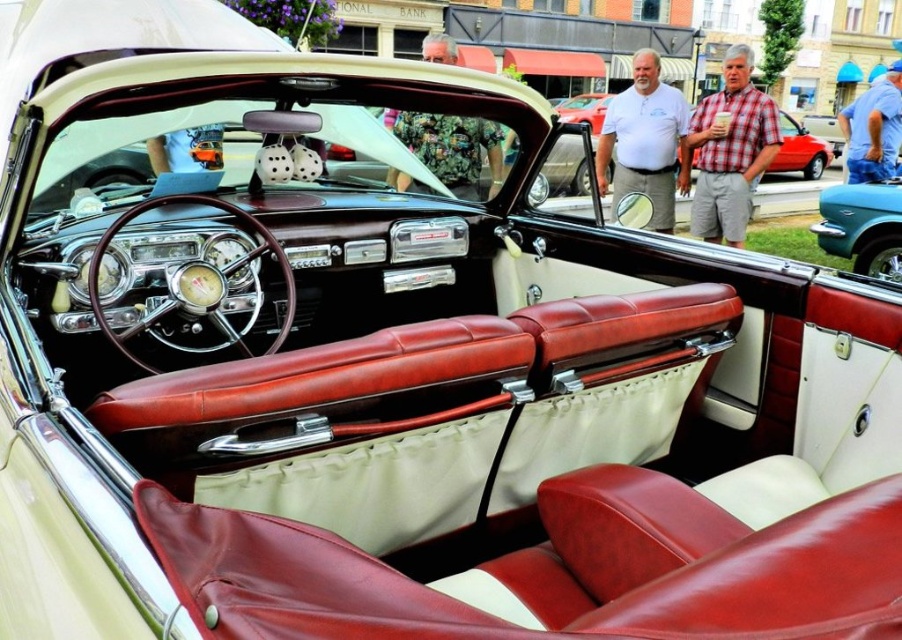
Does white cotton shirt at center have a smaller size compared to camouflage fabric shirt at upper center?

No.

The width and height of the screenshot is (902, 640). Identify the location of white cotton shirt at center. (646, 140).

Is teal metallic car at right wider than matte red leather car at center?

In fact, teal metallic car at right might be narrower than matte red leather car at center.

Is the position of teal metallic car at right more distant than that of matte red leather car at center?

Yes, teal metallic car at right is behind matte red leather car at center.

Between point (864, 220) and point (781, 129), which one is positioned in front?

Point (864, 220)

This screenshot has width=902, height=640. I want to click on teal metallic car at right, so click(862, 227).

Looking at this image, is plaid shirt at upper right bigger than camouflage fabric shirt at upper center?

Correct, plaid shirt at upper right is larger in size than camouflage fabric shirt at upper center.

Who is positioned more to the left, plaid shirt at upper right or camouflage fabric shirt at upper center?

camouflage fabric shirt at upper center

Does point (716, 113) come farther from viewer compared to point (445, 33)?

No.

The image size is (902, 640). In order to click on plaid shirt at upper right in this screenshot , I will do click(730, 150).